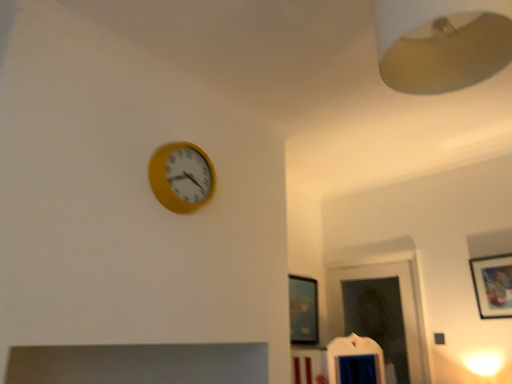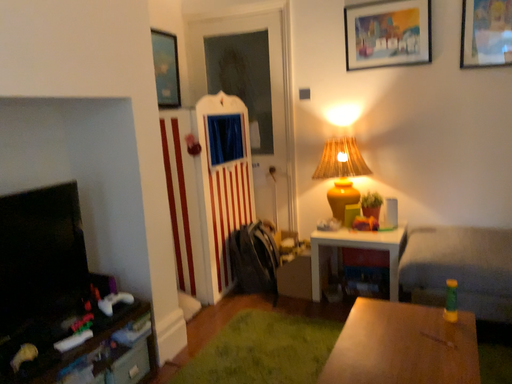
Question: Which way did the camera rotate in the video?

Choices:
 (A) rotated upward
 (B) rotated downward

Answer: (B)